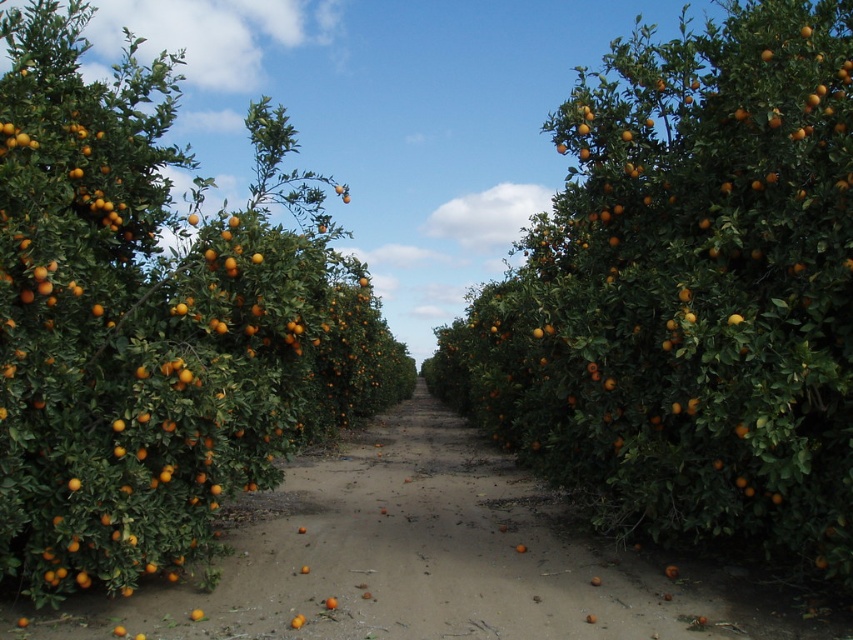
Question: Which object is closer to the camera taking this photo?

Choices:
 (A) orange glossy fruit at center
 (B) dirt path at center

Answer: (A)

Question: Considering the relative positions of orange glossy fruit at center and dirt path at center in the image provided, where is orange glossy fruit at center located with respect to dirt path at center?

Choices:
 (A) above
 (B) below

Answer: (A)

Question: Does orange glossy fruit at center have a lesser width compared to dirt path at center?

Choices:
 (A) yes
 (B) no

Answer: (B)

Question: Is orange glossy fruit at center below dirt path at center?

Choices:
 (A) yes
 (B) no

Answer: (B)

Question: Which point is closer to the camera?

Choices:
 (A) dirt path at center
 (B) orange glossy fruit at center

Answer: (B)

Question: Among these points, which one is nearest to the camera?

Choices:
 (A) (125, 442)
 (B) (416, 509)

Answer: (A)